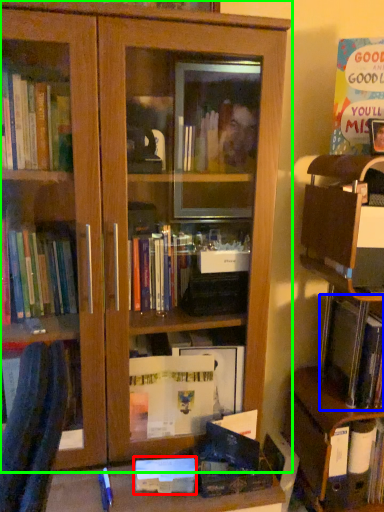
Question: Considering the real-world distances, which object is closest to paperback book (highlighted by a red box)? book (highlighted by a blue box) or bookcase (highlighted by a green box).

Choices:
 (A) book
 (B) bookcase

Answer: (A)